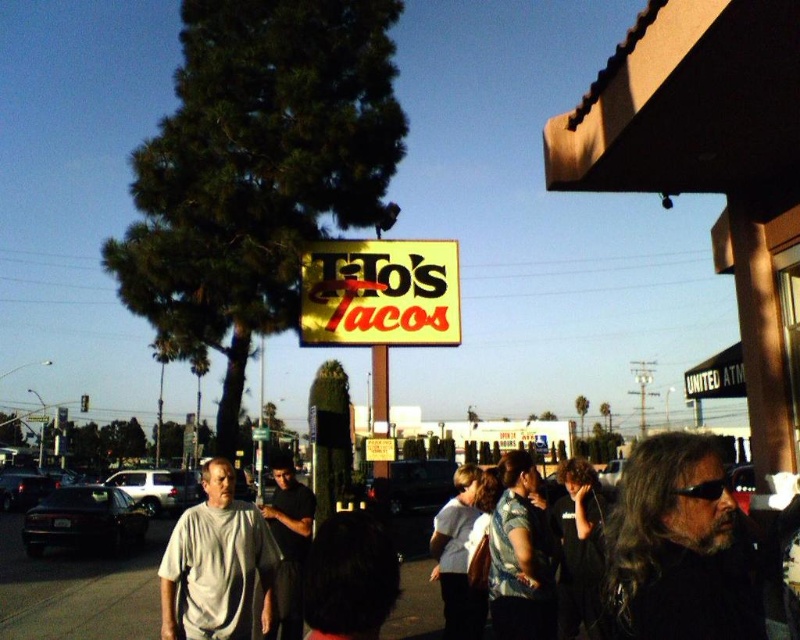
You are standing at the entrance of Tito s Tacos and want to find the person with dark brown hair at center. According to the image, where would you look relative to the center of the image?

The dark brown hair at center is located at the point (680, 547) in 2D coordinates, which is slightly to the right and slightly below the center of the image.

You are a photographer standing on the sidewalk and want to take a photo of the dark brown hair at center and the dark gray shirt at center. Which object will appear taller in the photo?

The dark brown hair at center will appear taller in the photo because it has a greater height compared to the dark gray shirt at center.

You are a photographer trying to capture a clear shot of the yellow plastic sign at center. However, there is someone with dark brown hair at center blocking your view. Can you move to the left or right to avoid the obstruction?

The dark brown hair at center is in front of the yellow plastic sign at center, so moving to either the left or right should allow you to see the yellow plastic sign at center by shifting your position around the obstruction.